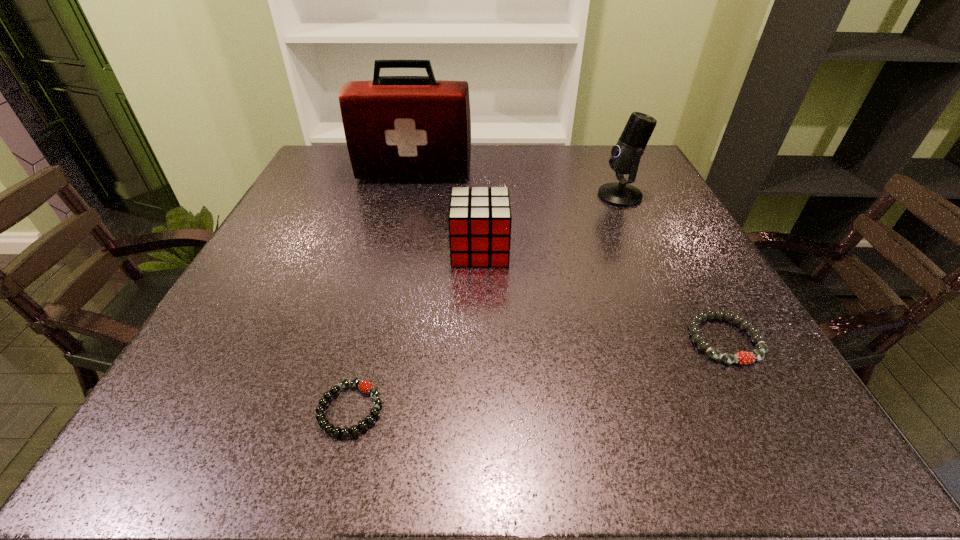
You are a GUI agent. You are given a task and a screenshot of the screen. Output one action in this format:
    pyautogui.click(x=<x>, y=<y>)
    Task: Click on the vacant space in between the right bracelet and the first aid kit
    
    Given the screenshot: What is the action you would take?
    pyautogui.click(x=569, y=256)

You are a GUI agent. You are given a task and a screenshot of the screen. Output one action in this format:
    pyautogui.click(x=<x>, y=<y>)
    Task: Click on the vacant region between the farther bracelet and the third farthest object
    Image resolution: width=960 pixels, height=540 pixels.
    Given the screenshot: What is the action you would take?
    pyautogui.click(x=602, y=295)

The width and height of the screenshot is (960, 540). In order to click on free space between the fourth farthest object and the nearer bracelet in this screenshot , I will do `click(537, 375)`.

You are a GUI agent. You are given a task and a screenshot of the screen. Output one action in this format:
    pyautogui.click(x=<x>, y=<y>)
    Task: Click on the vacant area that lies between the third nearest object and the nearer bracelet
    This screenshot has height=540, width=960.
    Given the screenshot: What is the action you would take?
    pyautogui.click(x=415, y=330)

Identify the location of vacant region between the microphone and the third tallest object. pos(550,223).

Find the location of a particular element. The height and width of the screenshot is (540, 960). empty space between the microphone and the cube is located at coordinates (550, 223).

At what (x,y) coordinates should I click in order to perform the action: click on empty space that is in between the nearest object and the right bracelet. Please return your answer as a coordinate pair (x, y). Looking at the image, I should click on (537, 375).

At what (x,y) coordinates should I click in order to perform the action: click on vacant space in between the second nearest object and the third nearest object. Please return your answer as a coordinate pair (x, y). The image size is (960, 540). Looking at the image, I should click on (602, 295).

Where is `free space between the microphone and the first aid kit`? The width and height of the screenshot is (960, 540). free space between the microphone and the first aid kit is located at coordinates [516, 185].

Where is `object that is the third closest to the tallest object`? This screenshot has height=540, width=960. object that is the third closest to the tallest object is located at coordinates (742, 357).